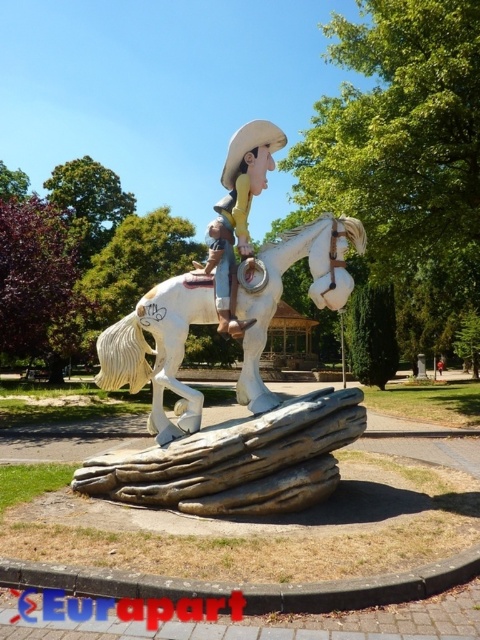
Between white glossy horse at center and smooth beige cowboy hat at center, which one is positioned higher?

smooth beige cowboy hat at center is above.

Which of these two, white glossy horse at center or smooth beige cowboy hat at center, stands shorter?

With less height is smooth beige cowboy hat at center.

Is point (252, 314) closer to viewer compared to point (251, 250)?

Yes.

The width and height of the screenshot is (480, 640). I want to click on white glossy horse at center, so click(158, 349).

Does matte yellow cowboy hat at center have a lesser height compared to smooth beige cowboy hat at center?

No, matte yellow cowboy hat at center is not shorter than smooth beige cowboy hat at center.

Can you confirm if matte yellow cowboy hat at center is positioned below smooth beige cowboy hat at center?

Incorrect, matte yellow cowboy hat at center is not positioned below smooth beige cowboy hat at center.

At what (x,y) coordinates should I click in order to perform the action: click on matte yellow cowboy hat at center. Please return your answer as a coordinate pair (x, y). This screenshot has height=640, width=480. Looking at the image, I should click on (239, 211).

In the scene shown: Does white glossy horse at center lie in front of matte yellow cowboy hat at center?

No, white glossy horse at center is behind matte yellow cowboy hat at center.

From the picture: Measure the distance from white glossy horse at center to matte yellow cowboy hat at center.

They are 31.89 inches apart.

Identify the location of white glossy horse at center. Image resolution: width=480 pixels, height=640 pixels. (158, 349).